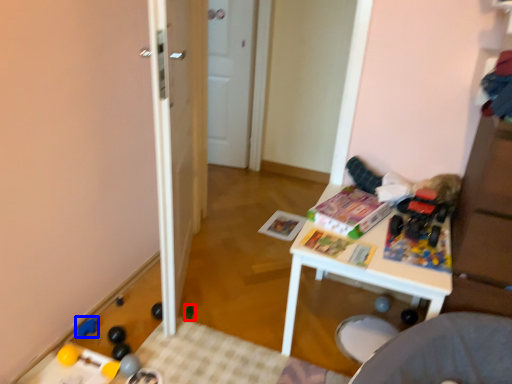
Question: Among these objects, which one is farthest to the camera, toy (highlighted by a red box) or toy (highlighted by a blue box)?

Choices:
 (A) toy
 (B) toy

Answer: (A)